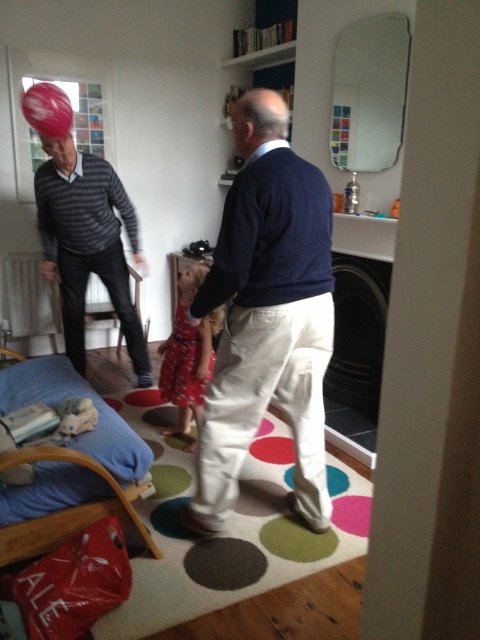
Question: Considering the real-world distances, which object is farthest from the red dress at center?

Choices:
 (A) smooth bald head at center
 (B) dark blue sweater at center

Answer: (A)

Question: Which object is positioned farthest from the red dress at center?

Choices:
 (A) matte black sweater at left
 (B) dark blue sweater at center
 (C) matte red dress at center

Answer: (B)

Question: Is dark blue sweater at center below smooth bald head at center?

Choices:
 (A) no
 (B) yes

Answer: (B)

Question: Considering the relative positions of smooth bald head at center and matte red dress at center in the image provided, where is smooth bald head at center located with respect to matte red dress at center?

Choices:
 (A) right
 (B) left

Answer: (A)

Question: Is smooth bald head at center positioned before matte red dress at center?

Choices:
 (A) no
 (B) yes

Answer: (B)

Question: Which of the following is the closest to the observer?

Choices:
 (A) matte red dress at center
 (B) red dress at center
 (C) smooth bald head at center
 (D) dark blue sweater at center

Answer: (D)